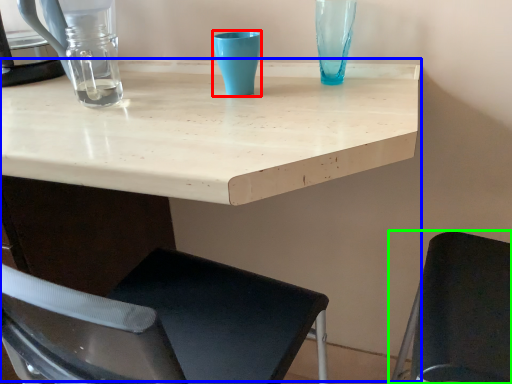
Question: Which object is the farthest from turquoise (highlighted by a red box)? Choose among these: table (highlighted by a blue box) or chair (highlighted by a green box).

Choices:
 (A) table
 (B) chair

Answer: (B)